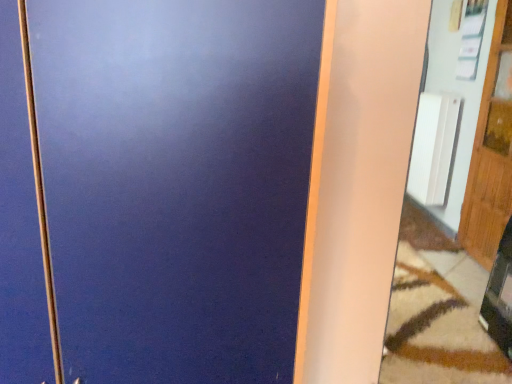
Question: Is wooden door at right thinner than white ribbed radiator at right?

Choices:
 (A) yes
 (B) no

Answer: (A)

Question: From the image's perspective, does wooden door at right appear higher than white ribbed radiator at right?

Choices:
 (A) no
 (B) yes

Answer: (A)

Question: Considering the relative positions of wooden door at right and white ribbed radiator at right in the image provided, is wooden door at right to the left of white ribbed radiator at right from the viewer's perspective?

Choices:
 (A) yes
 (B) no

Answer: (B)

Question: Is wooden door at right in contact with white ribbed radiator at right?

Choices:
 (A) yes
 (B) no

Answer: (B)

Question: Is wooden door at right smaller than white ribbed radiator at right?

Choices:
 (A) no
 (B) yes

Answer: (A)

Question: Is wooden door at right outside white ribbed radiator at right?

Choices:
 (A) yes
 (B) no

Answer: (A)

Question: Is matte white mirror at right thinner than wooden door at right?

Choices:
 (A) yes
 (B) no

Answer: (B)

Question: Is the depth of matte white mirror at right less than that of wooden door at right?

Choices:
 (A) yes
 (B) no

Answer: (A)

Question: Would you say matte white mirror at right is outside wooden door at right?

Choices:
 (A) no
 (B) yes

Answer: (B)

Question: Does matte white mirror at right appear on the right side of wooden door at right?

Choices:
 (A) no
 (B) yes

Answer: (A)

Question: From the image's perspective, is matte white mirror at right under wooden door at right?

Choices:
 (A) no
 (B) yes

Answer: (B)

Question: Does matte white mirror at right have a smaller size compared to wooden door at right?

Choices:
 (A) no
 (B) yes

Answer: (A)

Question: Is wooden door at right bigger than matte white mirror at right?

Choices:
 (A) yes
 (B) no

Answer: (B)